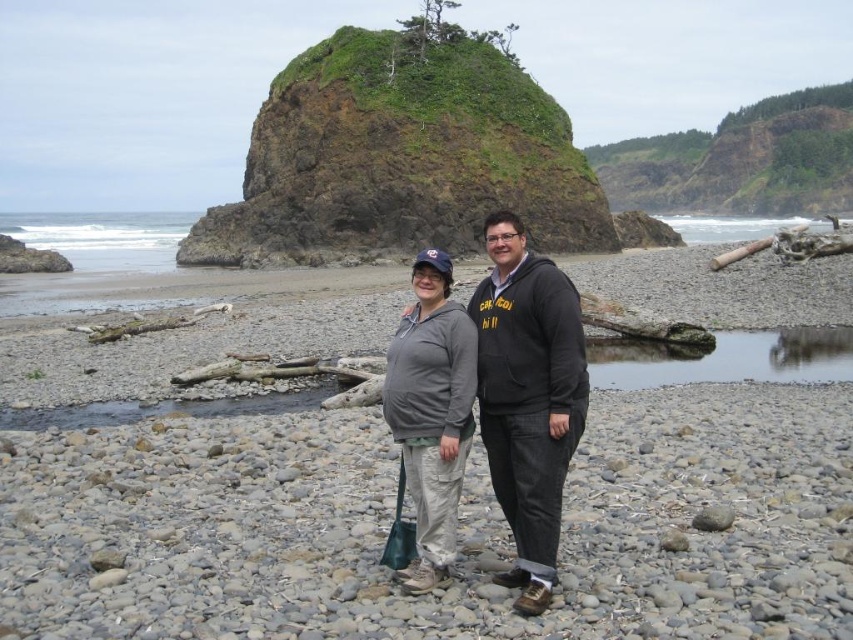
Question: Which object appears farthest from the camera in this image?

Choices:
 (A) gray fleece sweatshirt at center
 (B) smooth pebbles at center

Answer: (A)

Question: Which of the following is the closest to the observer?

Choices:
 (A) black fleece jacket at center
 (B) gray fleece sweatshirt at center

Answer: (A)

Question: Among these objects, which one is farthest from the camera?

Choices:
 (A) black fleece jacket at center
 (B) gray fleece sweatshirt at center
 (C) smooth pebbles at center

Answer: (B)

Question: Where is smooth pebbles at center located in relation to black fleece jacket at center in the image?

Choices:
 (A) left
 (B) right

Answer: (B)

Question: Is smooth pebbles at center wider than black fleece jacket at center?

Choices:
 (A) no
 (B) yes

Answer: (B)

Question: Does smooth pebbles at center have a greater width compared to gray fleece sweatshirt at center?

Choices:
 (A) yes
 (B) no

Answer: (A)